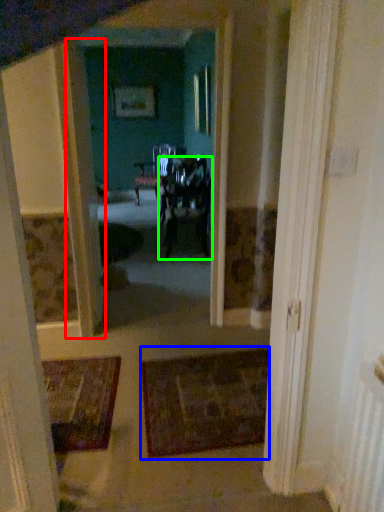
Question: Which object is positioned farthest from door (highlighted by a red box)? Select from doormat (highlighted by a blue box) and chair (highlighted by a green box).

Choices:
 (A) doormat
 (B) chair

Answer: (B)